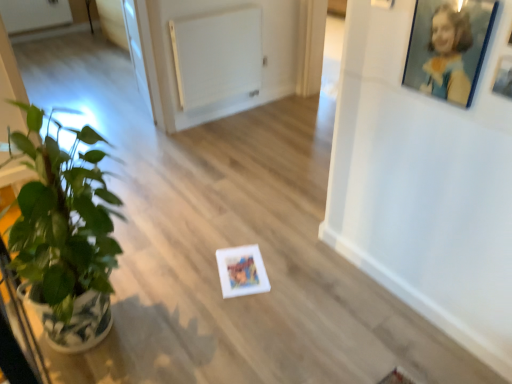
I want to click on vacant space underneath white matte radiator at upper center (from a real-world perspective), so click(223, 114).